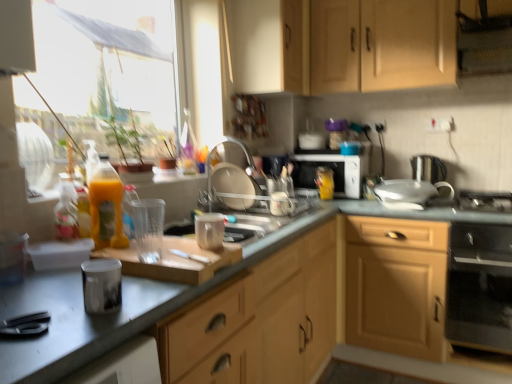
Question: Does translucent yellow bottle at left appear on the left side of light wood cabinet at lower right, positioned as the 3th cabinetry in top-to-bottom order?

Choices:
 (A) no
 (B) yes

Answer: (B)

Question: Is translucent yellow bottle at left bigger than light wood cabinet at lower right, which is the 1th cabinetry in bottom-to-top order?

Choices:
 (A) yes
 (B) no

Answer: (B)

Question: From the image's perspective, does translucent yellow bottle at left appear higher than light wood cabinet at lower right, positioned as the 3th cabinetry in top-to-bottom order?

Choices:
 (A) yes
 (B) no

Answer: (A)

Question: Does translucent yellow bottle at left have a greater width compared to light wood cabinet at lower right, which is the 1th cabinetry in bottom-to-top order?

Choices:
 (A) no
 (B) yes

Answer: (A)

Question: Is translucent yellow bottle at left positioned behind light wood cabinet at lower right, which is the 1th cabinetry in bottom-to-top order?

Choices:
 (A) no
 (B) yes

Answer: (A)

Question: Can you confirm if translucent yellow bottle at left is thinner than light wood cabinet at lower right, which is the 1th cabinetry in bottom-to-top order?

Choices:
 (A) yes
 (B) no

Answer: (A)

Question: Does light wood cabinet at upper center, positioned as the second cabinetry in top-to-bottom order, have a larger size compared to clear plastic dish rack at center, the 3th appliance when ordered from left to right?

Choices:
 (A) yes
 (B) no

Answer: (A)

Question: Considering the relative sizes of light wood cabinet at upper center, positioned as the second cabinetry in top-to-bottom order, and clear plastic dish rack at center, acting as the fourth appliance starting from the back, in the image provided, is light wood cabinet at upper center, positioned as the second cabinetry in top-to-bottom order, taller than clear plastic dish rack at center, acting as the fourth appliance starting from the back,?

Choices:
 (A) yes
 (B) no

Answer: (A)

Question: From a real-world perspective, is light wood cabinet at upper center, positioned as the second cabinetry in top-to-bottom order, positioned under clear plastic dish rack at center, acting as the fourth appliance starting from the back, based on gravity?

Choices:
 (A) yes
 (B) no

Answer: (B)

Question: Does light wood cabinet at upper center, positioned as the second cabinetry in top-to-bottom order, appear on the left side of clear plastic dish rack at center, the 3th appliance when ordered from left to right?

Choices:
 (A) yes
 (B) no

Answer: (B)

Question: Can you see light wood cabinet at upper center, positioned as the second cabinetry in top-to-bottom order, touching clear plastic dish rack at center, which is the fourth appliance in front-to-back order?

Choices:
 (A) no
 (B) yes

Answer: (A)

Question: Does light wood cabinet at upper center, positioned as the second cabinetry in top-to-bottom order, come behind clear plastic dish rack at center, acting as the fourth appliance starting from the back?

Choices:
 (A) no
 (B) yes

Answer: (A)

Question: Is transparent plastic glass at center, marked as the sixth appliance in a right-to-left arrangement, wider than clear plastic dish rack at center, which is the 5th appliance in right-to-left order?

Choices:
 (A) yes
 (B) no

Answer: (B)